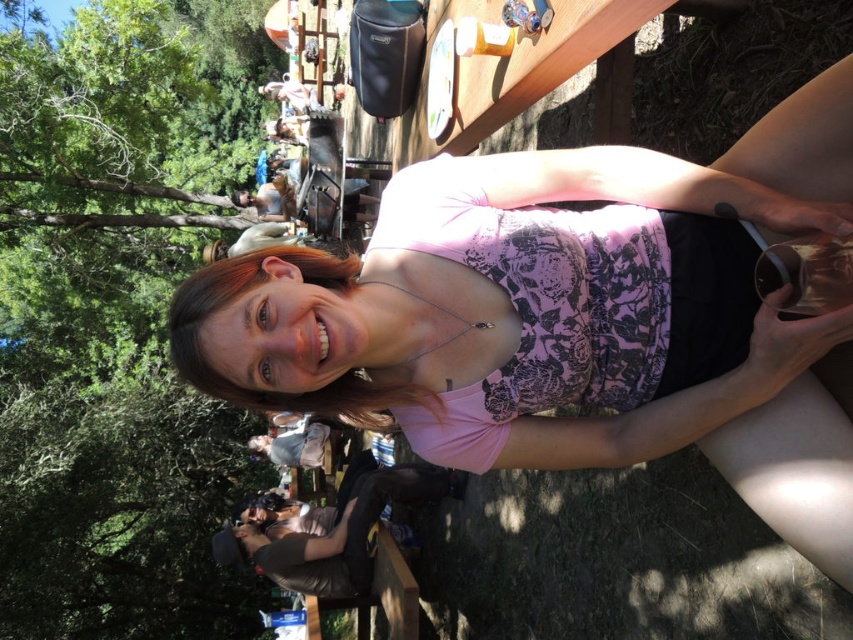
You are standing in the picnic area and want to move from point A to point B. Point A is located at coordinates point (264, 564) and point B is at point (370, 426). Which point is closer to you?

Point (264, 564) is closer to you because it is further to the viewer than point (370, 426) according to the description.